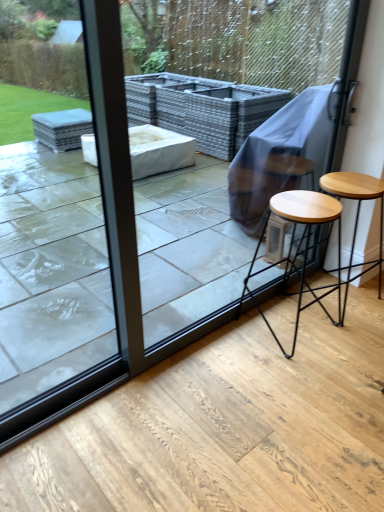
Question: Is point (26, 215) closer or farther from the camera than point (377, 292)?

Choices:
 (A) farther
 (B) closer

Answer: (A)

Question: From a real-world perspective, is transparent glass door at upper left positioned above or below light brown wood stool at right, marked as the 1th stool in a right-to-left arrangement?

Choices:
 (A) below
 (B) above

Answer: (B)

Question: Considering the real-world distances, which object is closest to the transparent glass screen door at upper center?

Choices:
 (A) light brown wood stool at lower right, the 1th stool when ordered from left to right
 (B) light brown wood stool at right, marked as the 1th stool in a right-to-left arrangement
 (C) transparent glass door at upper left

Answer: (B)

Question: Which object is the closest to the light brown wood stool at right, the 2th stool positioned from the left?

Choices:
 (A) transparent glass door at upper left
 (B) light brown wood stool at lower right, the 2th stool from the right
 (C) transparent glass screen door at upper center

Answer: (B)